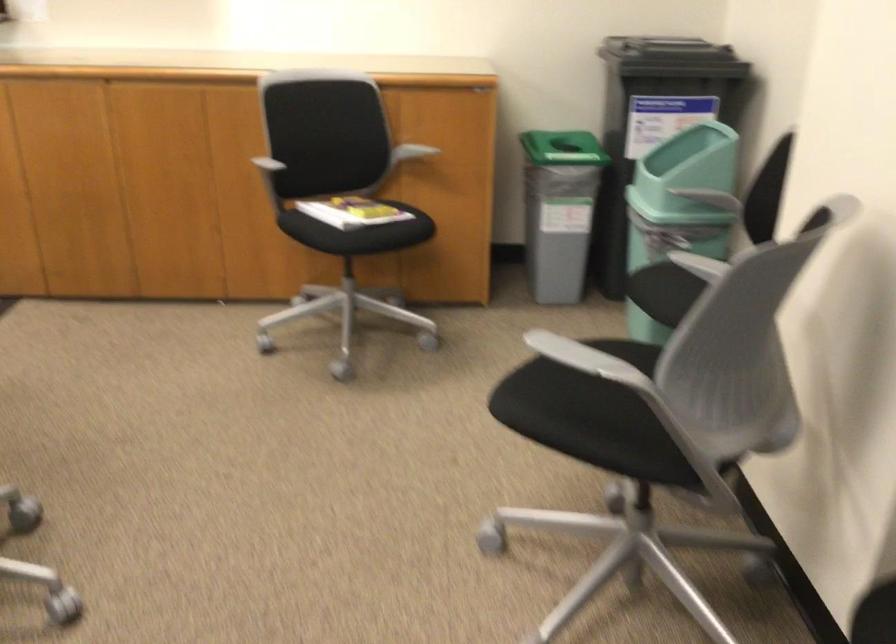
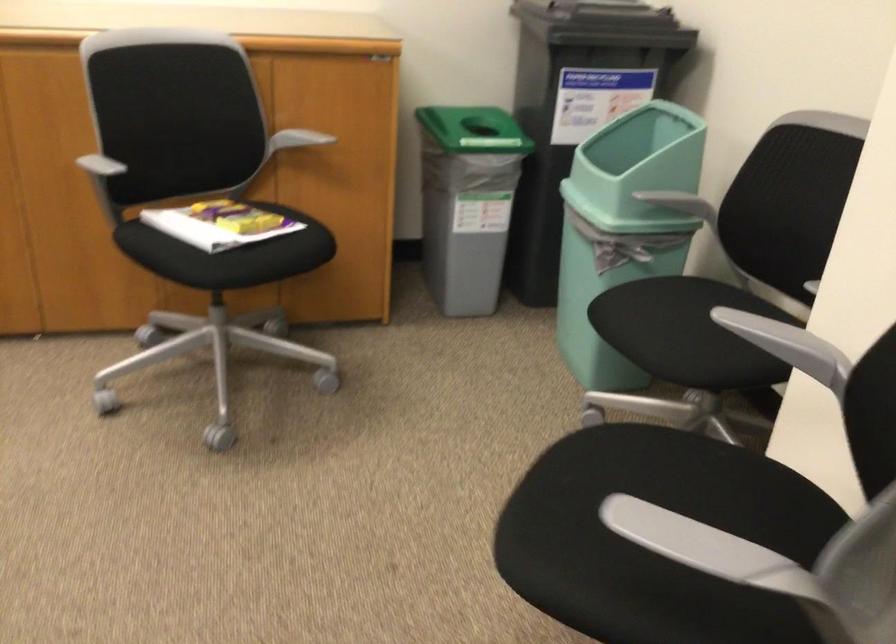
Question: What movement of the cameraman would produce the second image?

Choices:
 (A) Left
 (B) Right
 (C) Forward
 (D) Backward

Answer: (C)